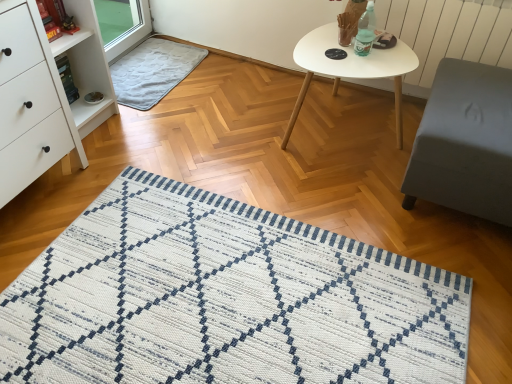
Question: Can you see translucent plastic bottle at upper right touching white matte oval table at upper center?

Choices:
 (A) no
 (B) yes

Answer: (A)

Question: Considering the relative sizes of translucent plastic bottle at upper right and white matte oval table at upper center in the image provided, is translucent plastic bottle at upper right wider than white matte oval table at upper center?

Choices:
 (A) yes
 (B) no

Answer: (B)

Question: From the image's perspective, is translucent plastic bottle at upper right over white matte oval table at upper center?

Choices:
 (A) yes
 (B) no

Answer: (A)

Question: Is translucent plastic bottle at upper right positioned in front of white matte oval table at upper center?

Choices:
 (A) yes
 (B) no

Answer: (B)

Question: Is translucent plastic bottle at upper right smaller than white matte oval table at upper center?

Choices:
 (A) yes
 (B) no

Answer: (A)

Question: Based on their sizes in the image, would you say gray soft rug at upper left is bigger or smaller than white matte chest of drawers at left?

Choices:
 (A) big
 (B) small

Answer: (B)

Question: Considering the positions of gray soft rug at upper left and white matte chest of drawers at left in the image, is gray soft rug at upper left taller or shorter than white matte chest of drawers at left?

Choices:
 (A) short
 (B) tall

Answer: (A)

Question: Considering the relative positions of gray soft rug at upper left and white matte chest of drawers at left in the image provided, is gray soft rug at upper left to the left or to the right of white matte chest of drawers at left?

Choices:
 (A) right
 (B) left

Answer: (A)

Question: Is point (146, 54) closer or farther from the camera than point (0, 104)?

Choices:
 (A) farther
 (B) closer

Answer: (A)

Question: Is white textured radiator at upper right inside the boundaries of white matte oval table at upper center, or outside?

Choices:
 (A) inside
 (B) outside

Answer: (B)

Question: From a real-world perspective, relative to white matte oval table at upper center, is white textured radiator at upper right vertically above or below?

Choices:
 (A) below
 (B) above

Answer: (B)

Question: Is point (471, 56) positioned closer to the camera than point (335, 36)?

Choices:
 (A) farther
 (B) closer

Answer: (B)

Question: Considering the positions of white textured radiator at upper right and white matte oval table at upper center in the image, is white textured radiator at upper right taller or shorter than white matte oval table at upper center?

Choices:
 (A) tall
 (B) short

Answer: (A)

Question: From a real-world perspective, relative to white matte oval table at upper center, is gray matte ottoman at right vertically above or below?

Choices:
 (A) above
 (B) below

Answer: (A)

Question: From the image's perspective, relative to white matte oval table at upper center, is gray matte ottoman at right above or below?

Choices:
 (A) above
 (B) below

Answer: (B)